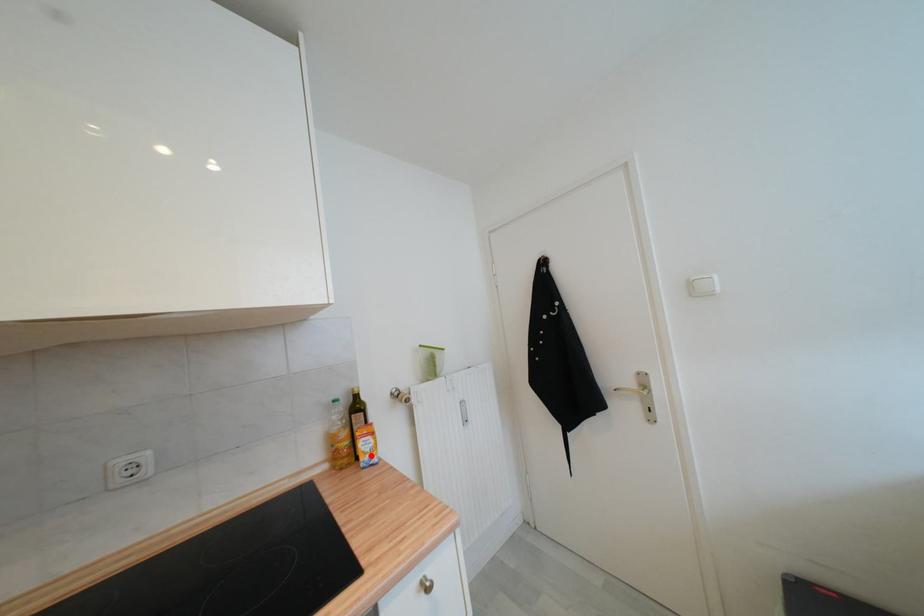
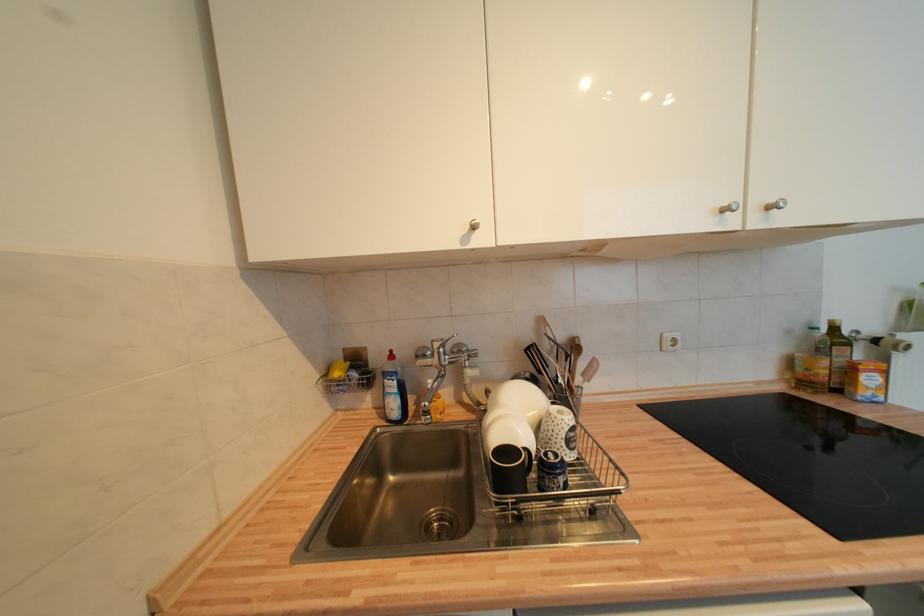
Question: A red point is marked in image1. In image2, is the corresponding 3D point closer to the camera or farther? Reply with the corresponding letter.

Choices:
 (A) The corresponding 3D point is closer.
 (B) The corresponding 3D point is farther.

Answer: (A)